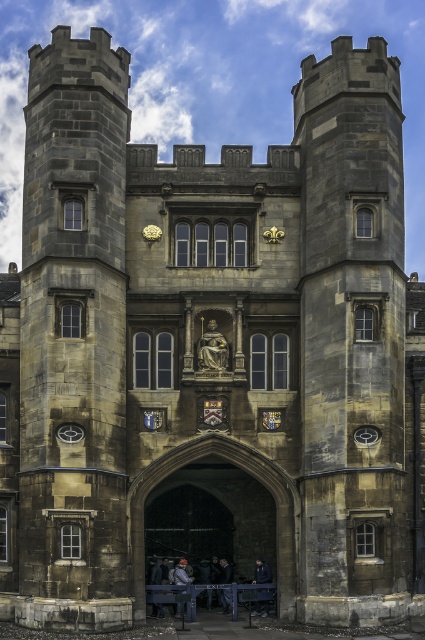
Question: Which point is farther from the camera taking this photo?

Choices:
 (A) (376, 436)
 (B) (294, 500)
 (C) (153, 593)

Answer: (C)

Question: Is wooden park bench at lower center to the right of gold metallic clock at lower right from the viewer's perspective?

Choices:
 (A) no
 (B) yes

Answer: (A)

Question: Is stone archway at center thinner than wooden park bench at lower center?

Choices:
 (A) yes
 (B) no

Answer: (B)

Question: Which object appears closest to the camera in this image?

Choices:
 (A) stone archway at center
 (B) wooden park bench at lower center
 (C) gold metallic clock at lower right

Answer: (C)

Question: Considering the relative positions of stone archway at center and gold metallic clock at lower right in the image provided, where is stone archway at center located with respect to gold metallic clock at lower right?

Choices:
 (A) right
 (B) left

Answer: (B)

Question: Considering the real-world distances, which object is closest to the wooden park bench at lower center?

Choices:
 (A) stone archway at center
 (B) gold metallic clock at lower right

Answer: (A)